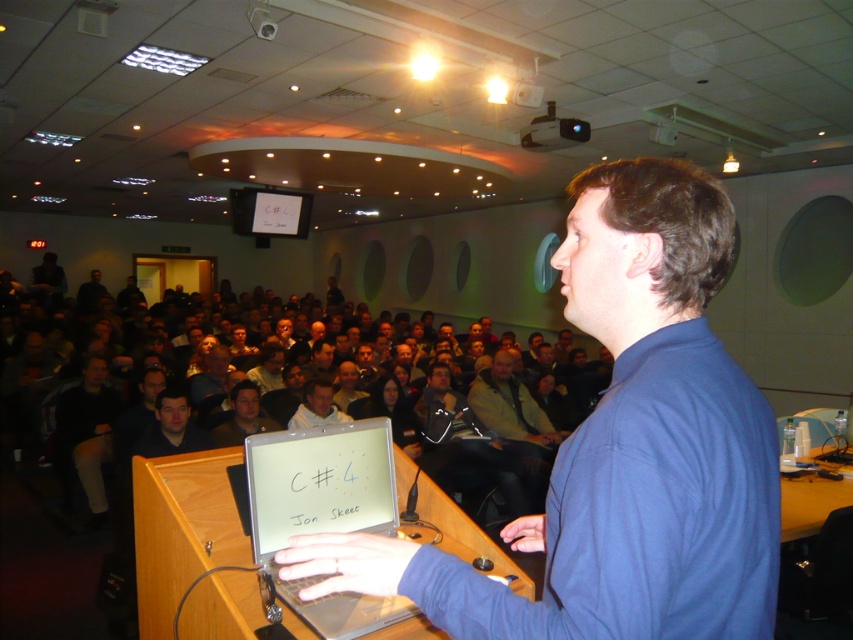
You are sitting at the point labeled point (590, 561) and want to walk to the exit door located at point (343, 593). Can you walk directly to the exit without moving around any obstacles?

Point (590, 561) is in front of point (343, 593), so you can walk directly to the exit without moving around any obstacles.

You are an attendee in the lecture hall and want to take a photo of the presenter. To do so, you need to ensure the blue fabric shirt at center and the silver metallic laptop at center are both visible in the frame. Based on their positions, which object should you position closer to the left side of your camera viewfinder to include both?

The blue fabric shirt at center is to the right of the silver metallic laptop at center. To include both in the frame, position the silver metallic laptop at center closer to the left side of your camera viewfinder so that the blue fabric shirt at center, which is to its right, remains within the frame.